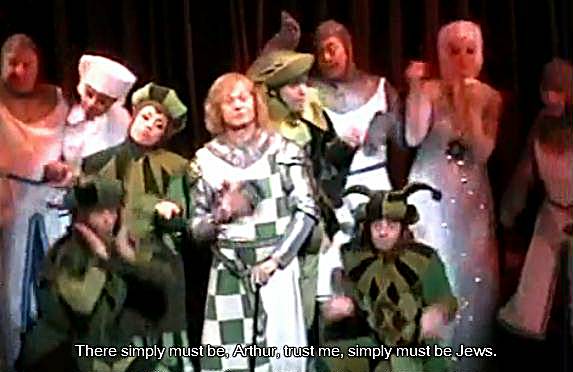
At what (x,y) coordinates should I click in order to perform the action: click on curtain. Please return your answer as a coordinate pair (x, y). The width and height of the screenshot is (573, 372). Looking at the image, I should click on (187, 40).